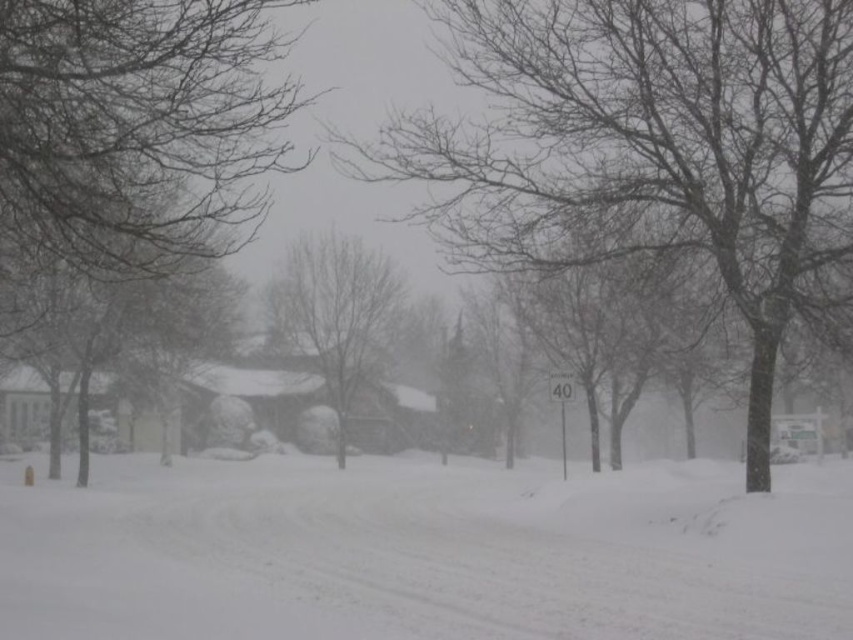
You are a delivery person trying to navigate through the snowy street. You see the white fluffy snow at center and the bare branches at left. Which object is positioned to the right of the other?

The white fluffy snow at center is to the right of the bare branches at left.

You are standing at the origin point of the coordinate system in this snowy scene. You want to walk to point A at coordinates point (596, 32) and point B at coordinates point (22, 237). Which point will you reach first?

You will reach point B at coordinates point (22, 237) first because it is closer to you than point A at coordinates point (596, 32), which is further away.